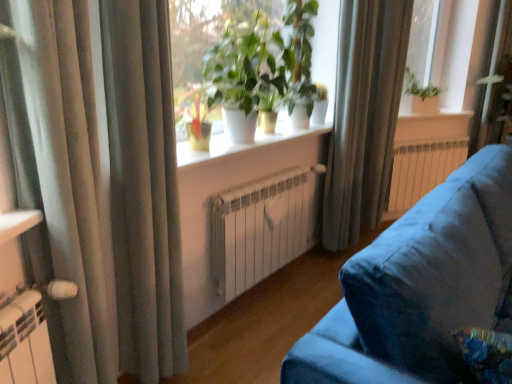
Question: From the image's perspective, does white glossy window sill at center, the 1th window sill positioned from the front, appear lower than silky gray curtain at upper right, marked as the 1th curtain in a back-to-front arrangement?

Choices:
 (A) no
 (B) yes

Answer: (B)

Question: Is white glossy window sill at center, which is the 2th window sill in back-to-front order, not close to silky gray curtain at upper right, placed as the 3th curtain when sorted from left to right?

Choices:
 (A) no
 (B) yes

Answer: (A)

Question: Can you confirm if white glossy window sill at center, acting as the 2th window sill starting from the top, is bigger than silky gray curtain at upper right, the first curtain positioned from the right?

Choices:
 (A) yes
 (B) no

Answer: (B)

Question: Considering the relative positions of white glossy window sill at center, the second window sill when ordered from right to left, and silky gray curtain at upper right, the first curtain positioned from the right, in the image provided, is white glossy window sill at center, the second window sill when ordered from right to left, behind silky gray curtain at upper right, the first curtain positioned from the right,?

Choices:
 (A) no
 (B) yes

Answer: (A)

Question: Considering the relative positions of white glossy window sill at center, which is the 1th window sill in bottom-to-top order, and silky gray curtain at upper right, marked as the 1th curtain in a back-to-front arrangement, in the image provided, is white glossy window sill at center, which is the 1th window sill in bottom-to-top order, to the right of silky gray curtain at upper right, marked as the 1th curtain in a back-to-front arrangement, from the viewer's perspective?

Choices:
 (A) yes
 (B) no

Answer: (B)

Question: From a real-world perspective, is white glossy window sill at center, which is the 1th window sill in bottom-to-top order, below silky gray curtain at upper right, marked as the 1th curtain in a back-to-front arrangement?

Choices:
 (A) no
 (B) yes

Answer: (A)

Question: Does white glossy window sill at center, which is the 2th window sill in back-to-front order, have a greater height compared to velvet blue couch at lower right?

Choices:
 (A) no
 (B) yes

Answer: (A)

Question: Is the position of white glossy window sill at center, which is the 1th window sill in bottom-to-top order, more distant than that of velvet blue couch at lower right?

Choices:
 (A) yes
 (B) no

Answer: (A)

Question: Is the position of white glossy window sill at center, the second window sill when ordered from right to left, less distant than that of velvet blue couch at lower right?

Choices:
 (A) no
 (B) yes

Answer: (A)

Question: From a real-world perspective, is white glossy window sill at center, which is the 2th window sill in back-to-front order, on top of velvet blue couch at lower right?

Choices:
 (A) no
 (B) yes

Answer: (B)

Question: Considering the relative positions of white glossy window sill at center, the 1th window sill positioned from the front, and velvet blue couch at lower right in the image provided, is white glossy window sill at center, the 1th window sill positioned from the front, to the left of velvet blue couch at lower right from the viewer's perspective?

Choices:
 (A) no
 (B) yes

Answer: (B)

Question: Does white glossy window sill at center, which is the 2th window sill in back-to-front order, have a lesser height compared to velvet blue couch at lower right?

Choices:
 (A) yes
 (B) no

Answer: (A)

Question: Does velvet blue couch at lower right have a greater height compared to silky gray curtain at upper right, which appears as the third curtain when viewed from the front?

Choices:
 (A) no
 (B) yes

Answer: (A)